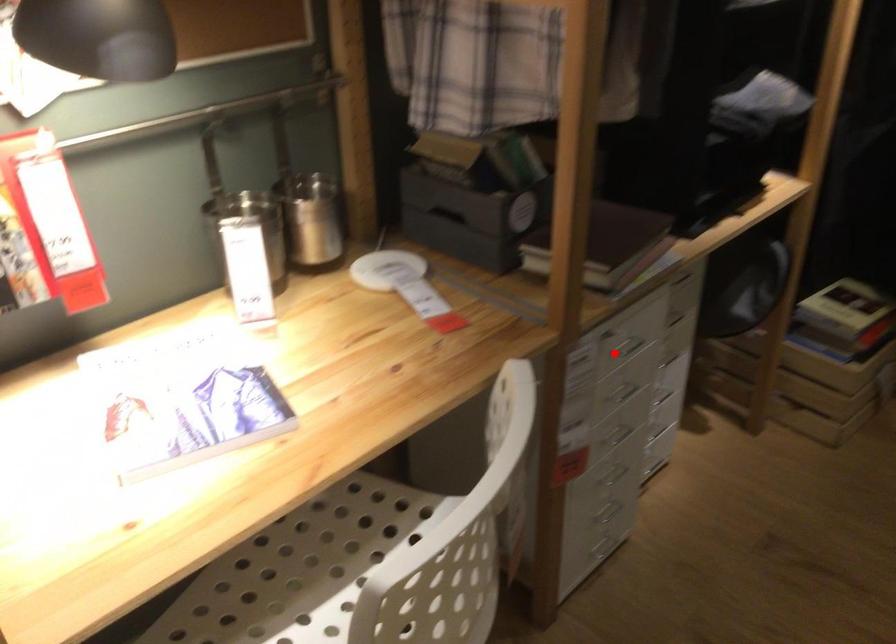
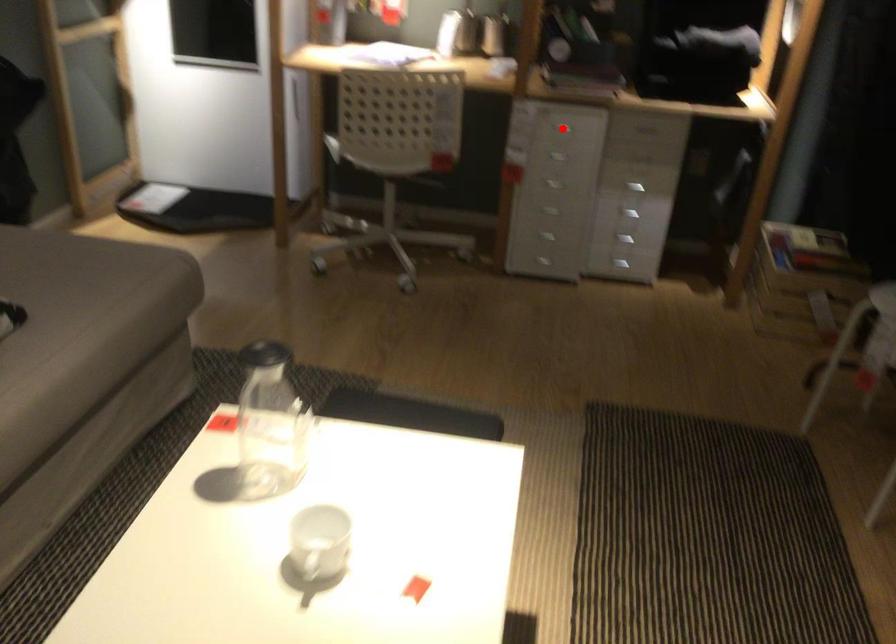
Consider the image. I am providing you with two images of the same scene from different viewpoints. A red point is marked on the first image and another point is marked on the second image. Is the red point in image1 aligned with the point shown in image2?

Yes